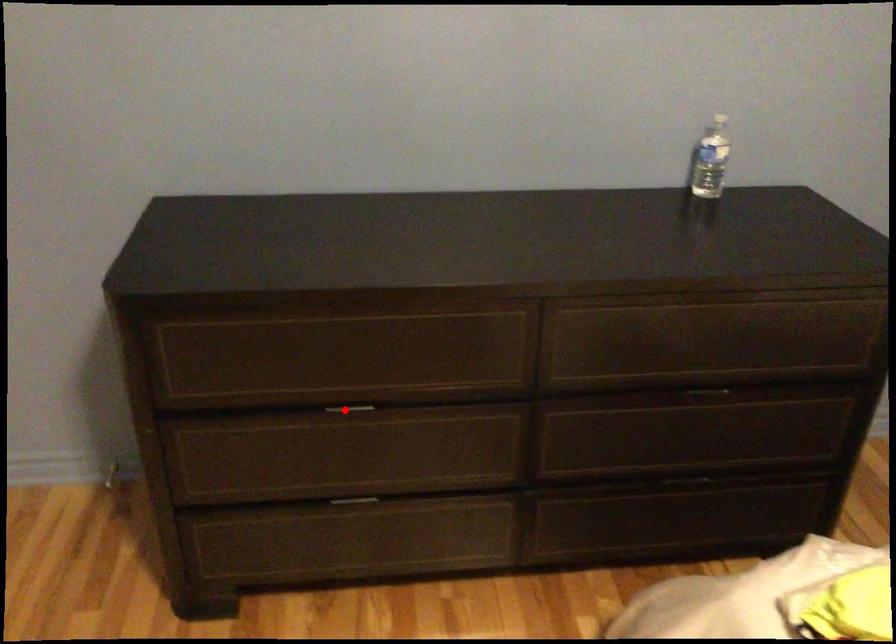
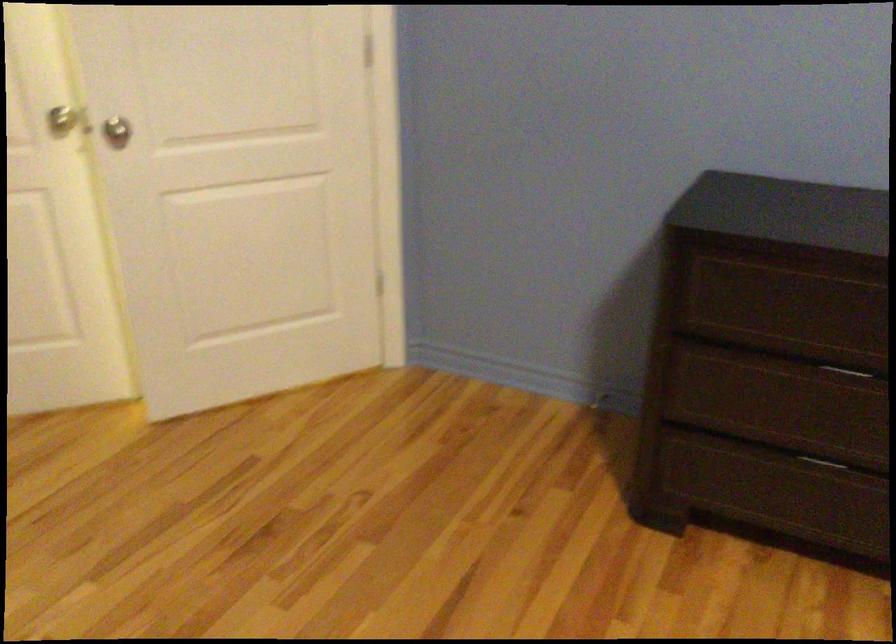
The point at the highlighted location is marked in the first image. Where is the corresponding point in the second image?

(850, 371)